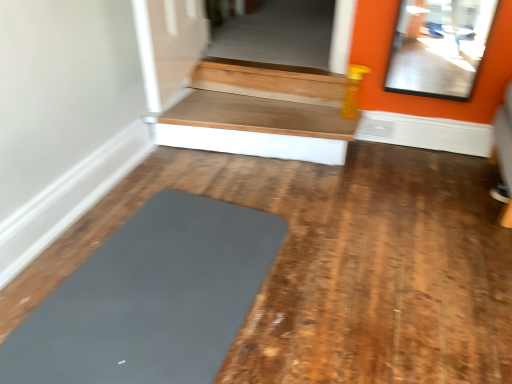
Question: From a real-world perspective, does wooden at upper right sit lower than matte gray yoga mat at center?

Choices:
 (A) yes
 (B) no

Answer: (B)

Question: Does wooden at upper right have a greater width compared to matte gray yoga mat at center?

Choices:
 (A) no
 (B) yes

Answer: (A)

Question: Is wooden at upper right in contact with matte gray yoga mat at center?

Choices:
 (A) no
 (B) yes

Answer: (A)

Question: Is wooden at upper right surrounding matte gray yoga mat at center?

Choices:
 (A) no
 (B) yes

Answer: (A)

Question: Does wooden at upper right have a larger size compared to matte gray yoga mat at center?

Choices:
 (A) yes
 (B) no

Answer: (A)

Question: Is wooden at upper right thinner than matte gray yoga mat at center?

Choices:
 (A) no
 (B) yes

Answer: (B)

Question: Is matte gray yoga mat at center next to wooden at upper right and touching it?

Choices:
 (A) yes
 (B) no

Answer: (B)

Question: Is matte gray yoga mat at center bigger than wooden at upper right?

Choices:
 (A) no
 (B) yes

Answer: (A)

Question: Does matte gray yoga mat at center have a smaller size compared to wooden at upper right?

Choices:
 (A) yes
 (B) no

Answer: (A)

Question: Is matte gray yoga mat at center positioned with its back to wooden at upper right?

Choices:
 (A) no
 (B) yes

Answer: (A)

Question: From the image's perspective, is matte gray yoga mat at center located beneath wooden at upper right?

Choices:
 (A) no
 (B) yes

Answer: (B)

Question: Considering the relative sizes of matte gray yoga mat at center and wooden at upper right in the image provided, is matte gray yoga mat at center taller than wooden at upper right?

Choices:
 (A) no
 (B) yes

Answer: (A)

Question: Choose the correct answer: Is matte gray yoga mat at center inside wooden at upper right or outside it?

Choices:
 (A) outside
 (B) inside

Answer: (A)